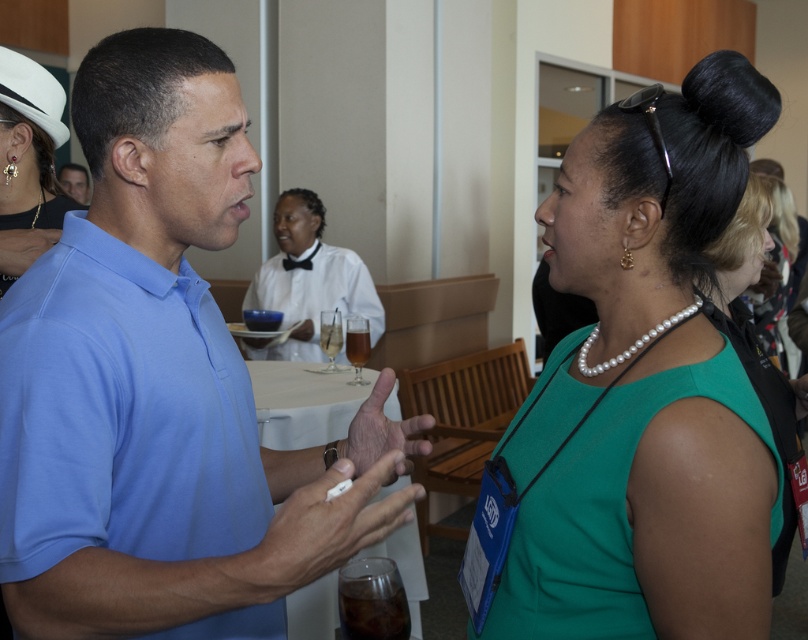
Is pearl earrings at upper left thinner than white satin dress at center?

Indeed, pearl earrings at upper left has a lesser width compared to white satin dress at center.

Image resolution: width=808 pixels, height=640 pixels. What do you see at coordinates (28, 163) in the screenshot? I see `pearl earrings at upper left` at bounding box center [28, 163].

Does point (20, 216) lie in front of point (310, 196)?

Yes, it is.

This screenshot has height=640, width=808. I want to click on pearl earrings at upper left, so click(x=28, y=163).

Who is taller, blue smooth shirt at left or pearl earrings at upper left?

With more height is blue smooth shirt at left.

Who is shorter, blue smooth shirt at left or pearl earrings at upper left?

pearl earrings at upper left

Which is behind, point (215, 125) or point (11, 80)?

Positioned behind is point (11, 80).

Locate an element on the screen. The width and height of the screenshot is (808, 640). blue smooth shirt at left is located at coordinates (161, 387).

Which is behind, point (634, 385) or point (297, 259)?

Positioned behind is point (297, 259).

Is green fabric dress at center above white satin dress at center?

Actually, green fabric dress at center is below white satin dress at center.

Does point (739, 529) lie in front of point (284, 307)?

Yes.

Identify the location of green fabric dress at center. (646, 388).